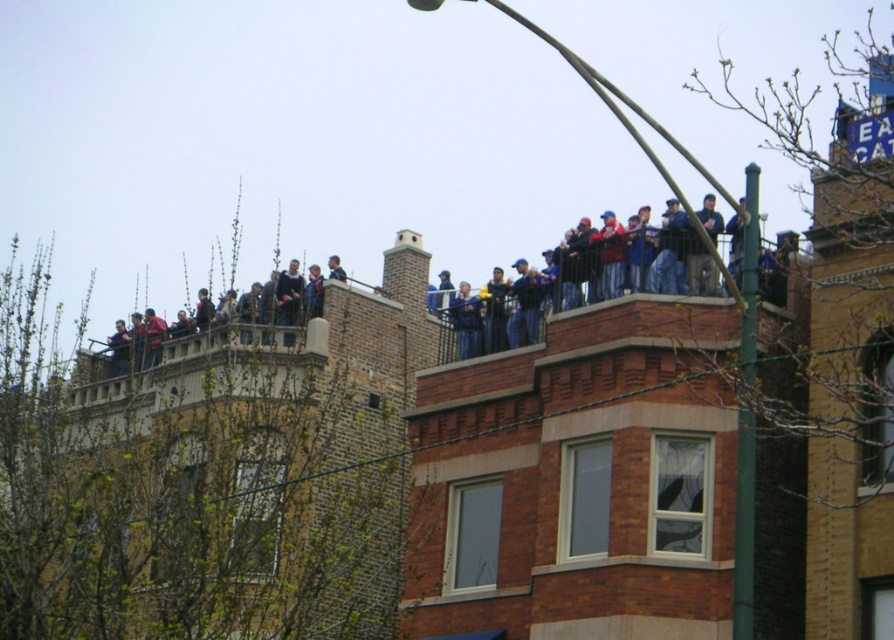
Does green metallic pole at upper center have a larger size compared to dark blue jeans at upper center?

Yes.

Identify the location of green metallic pole at upper center. This screenshot has width=894, height=640. (585, 486).

Is green painted metal pole at upper right in front of blue denim jeans at upper center?

Yes.

Does green painted metal pole at upper right have a greater height compared to blue denim jeans at upper center?

Yes, green painted metal pole at upper right is taller than blue denim jeans at upper center.

Find the location of `green painted metal pole at upper right`. green painted metal pole at upper right is located at coordinates (746, 413).

Where is `green painted metal pole at upper right`? This screenshot has width=894, height=640. green painted metal pole at upper right is located at coordinates (746, 413).

Who is positioned more to the right, green metallic pole at upper center or green painted metal pole at upper right?

green painted metal pole at upper right is more to the right.

Image resolution: width=894 pixels, height=640 pixels. Identify the location of green metallic pole at upper center. (585, 486).